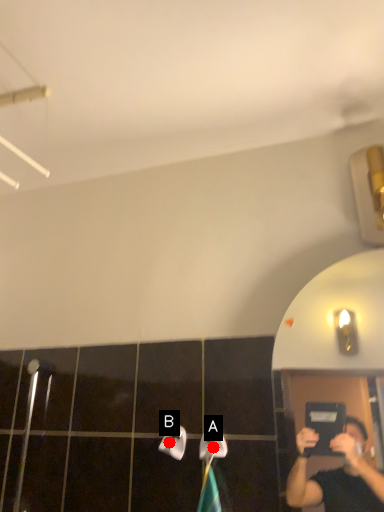
Question: Two points are circled on the image, labeled by A and B beside each circle. Which point is closer to the camera?

Choices:
 (A) A is closer
 (B) B is closer

Answer: (A)